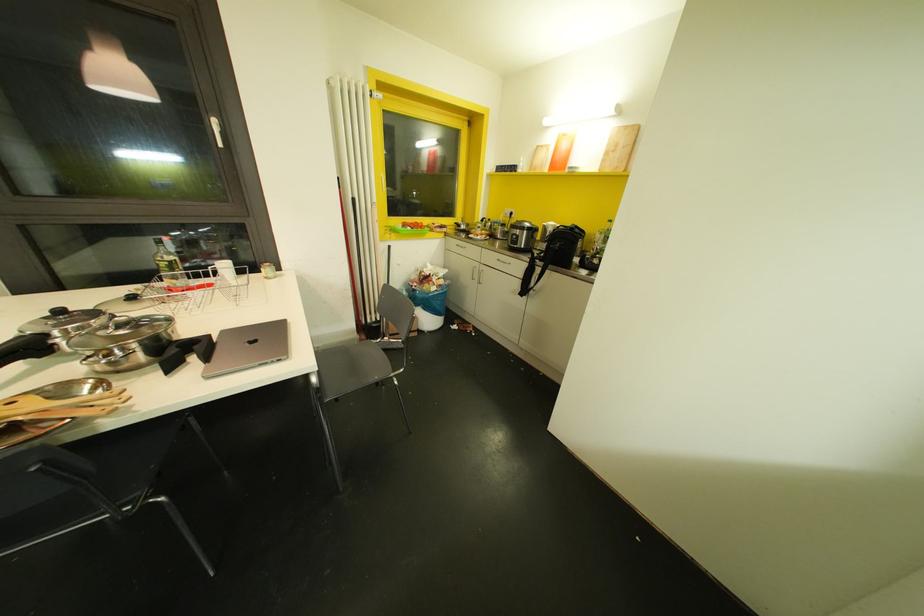
At what (x,y) coordinates should I click in order to perform the action: click on glass oil bottle. Please return your answer as a coordinate pair (x, y). This screenshot has width=924, height=616. Looking at the image, I should click on tap(168, 265).